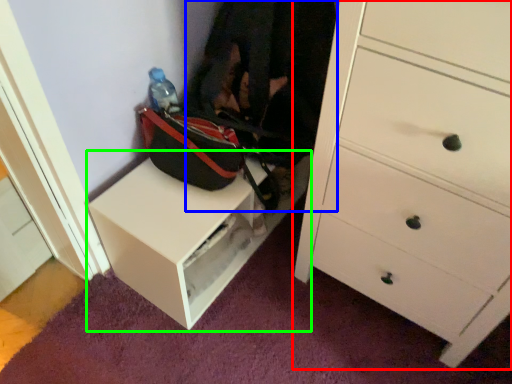
Question: Estimate the real-world distances between objects in this image. Which object is closer to chest of drawers (highlighted by a red box), clothing (highlighted by a blue box) or table (highlighted by a green box)?

Choices:
 (A) clothing
 (B) table

Answer: (A)